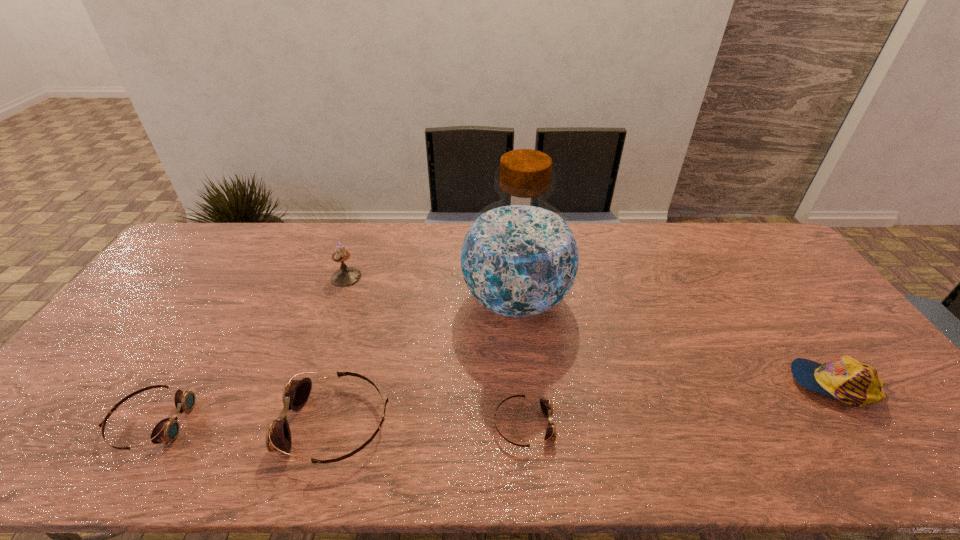
The height and width of the screenshot is (540, 960). Find the location of `vacant space that is in between the fifth shortest object and the tallest object`. vacant space that is in between the fifth shortest object and the tallest object is located at coordinates (431, 288).

This screenshot has height=540, width=960. In order to click on free spot between the second tallest goggles and the cap in this screenshot , I will do `click(492, 403)`.

Where is `free space between the second tallest goggles and the candle holder`? The height and width of the screenshot is (540, 960). free space between the second tallest goggles and the candle holder is located at coordinates (249, 349).

I want to click on empty location between the rightmost object and the leftmost goggles, so click(492, 403).

The width and height of the screenshot is (960, 540). I want to click on unoccupied position between the cap and the second goggles from left to right, so click(x=585, y=404).

This screenshot has width=960, height=540. I want to click on free space between the shortest object and the leftmost object, so click(337, 423).

Identify the location of object that is the third nearest to the second goggles from left to right. Image resolution: width=960 pixels, height=540 pixels. (546, 406).

Where is `object that is the fifth closest to the rightmost object`? Image resolution: width=960 pixels, height=540 pixels. object that is the fifth closest to the rightmost object is located at coordinates (167, 430).

Where is `goggles that is the closest to the second tallest object`? goggles that is the closest to the second tallest object is located at coordinates (296, 392).

Select which goggles appears as the second closest to the water jug. Please provide its 2D coordinates. Your answer should be formatted as a tuple, i.e. [(x, y)], where the tuple contains the x and y coordinates of a point satisfying the conditions above.

[(296, 392)]